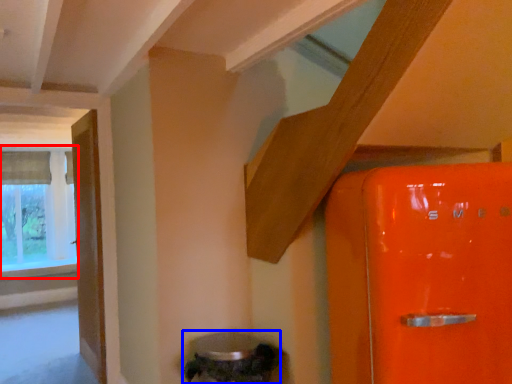
Question: Which point is closer to the camera, window (highlighted by a red box) or water heater (highlighted by a blue box)?

Choices:
 (A) window
 (B) water heater

Answer: (B)